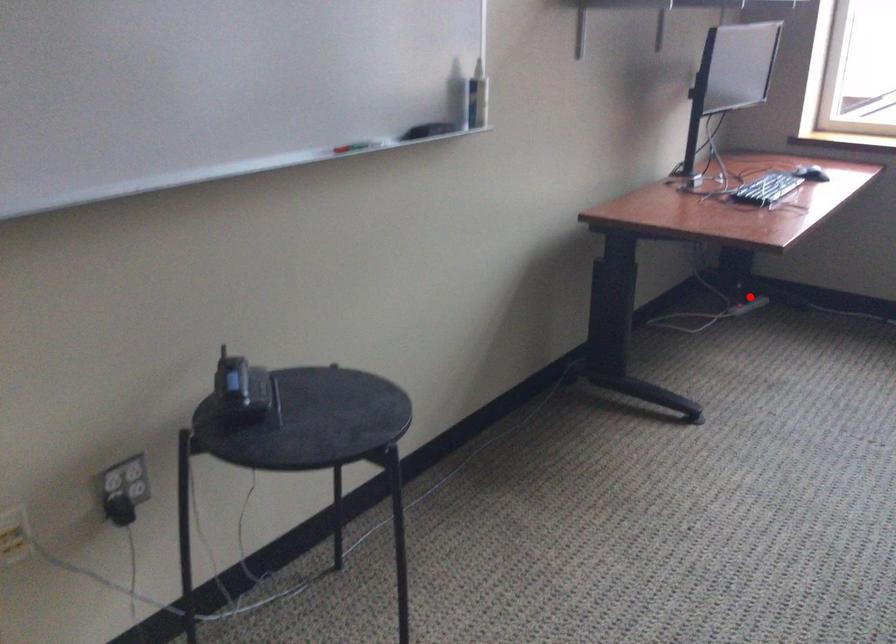
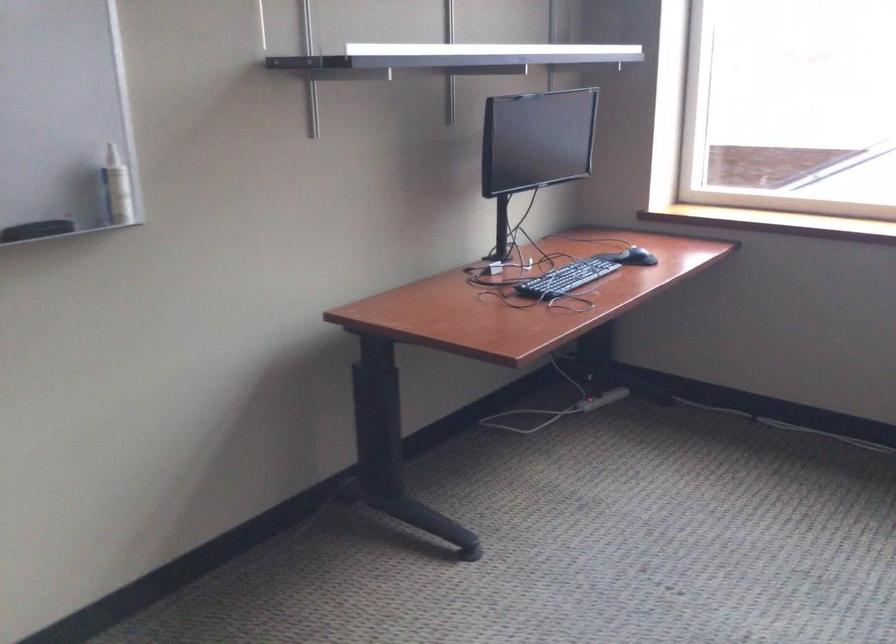
The point at the highlighted location is marked in the first image. Where is the corresponding point in the second image?

(587, 404)